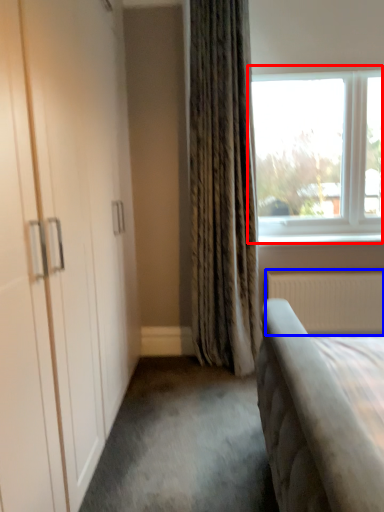
Question: Which object appears closest to the camera in this image, window (highlighted by a red box) or radiator (highlighted by a blue box)?

Choices:
 (A) window
 (B) radiator

Answer: (A)